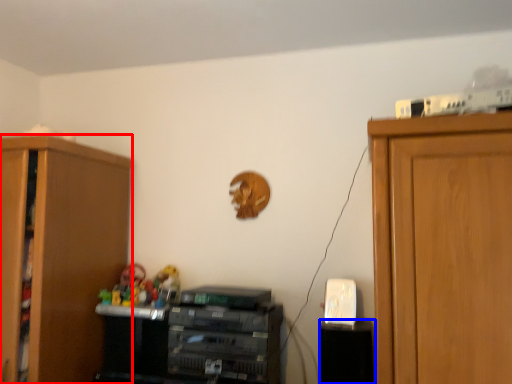
Question: Which point is closer to the camera, cabinetry (highlighted by a red box) or cabinetry (highlighted by a blue box)?

Choices:
 (A) cabinetry
 (B) cabinetry

Answer: (A)